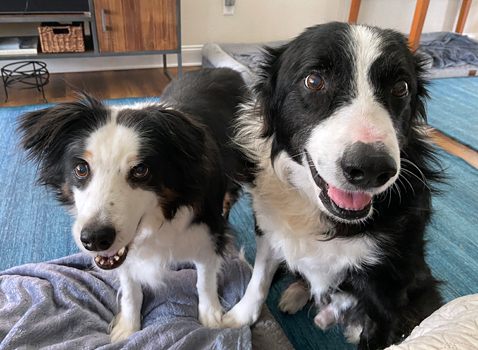
At what (x,y) coordinates should I click in order to perform the action: click on wicker basket. Please return your answer as a coordinate pair (x, y). Looking at the image, I should click on (63, 35).